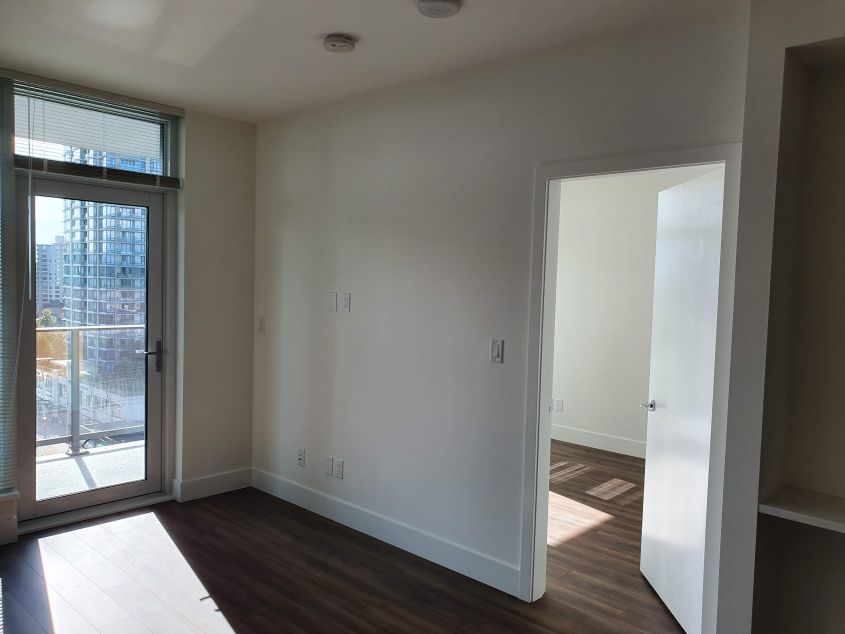
In order to click on outlets in this screenshot , I will do `click(339, 467)`, `click(329, 468)`, `click(297, 456)`, `click(335, 299)`, `click(350, 302)`, `click(559, 409)`.